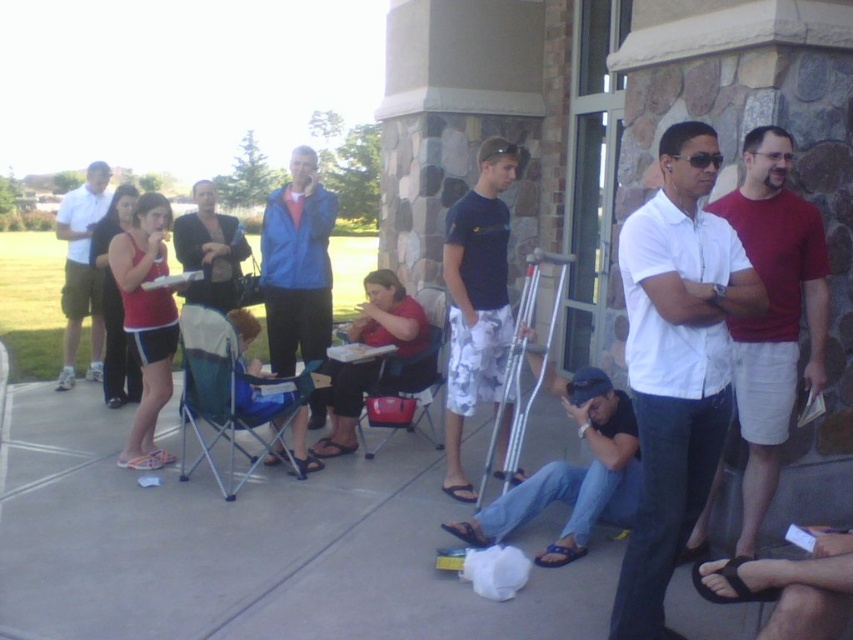
You are organizing a photo shoot and need to position two models based on their clothing. You have a white cotton shirt at right and denim jeans at lower center. Which clothing item is located more to the right in the scene?

The white cotton shirt at right is positioned on the right side of denim jeans at lower center, so the white cotton shirt at right is more to the right.

You are standing at the origin point of the image. Where is the white cotton shirt at right located in terms of coordinates?

The white cotton shirt at right is located at coordinates point (773, 310).